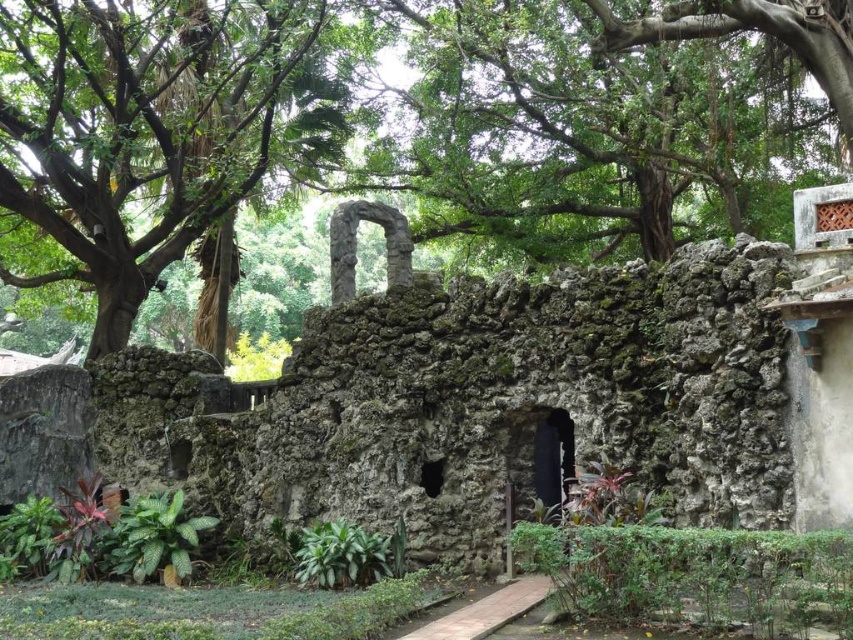
You are a landscape architect designing a pathway between the rough stone ruins at center and the green leafy tree at upper left. Which object has a larger horizontal span that you need to consider for spacing?

The rough stone ruins at center has a larger width than the green leafy tree at upper left, so you should consider its horizontal span for spacing.

You are a gardener planning to install a new lighting system. The lights need to be placed at the base of both the rough stone ruins at center and the green rough bark tree at center. Which object requires taller lights to ensure the light reaches its top?

The green rough bark tree at center requires taller lights because it is taller than the rough stone ruins at center.

You are standing in front of the rustic stone structure and want to take a photo that includes both the rough stone ruins at center and the green leafy tree at upper left. Which object should you position closer to the camera to ensure both are in focus?

You should position the rough stone ruins at center closer to the camera because it is closer to the viewer than the green leafy tree at upper left, so keeping them at similar distances will help both be in focus.